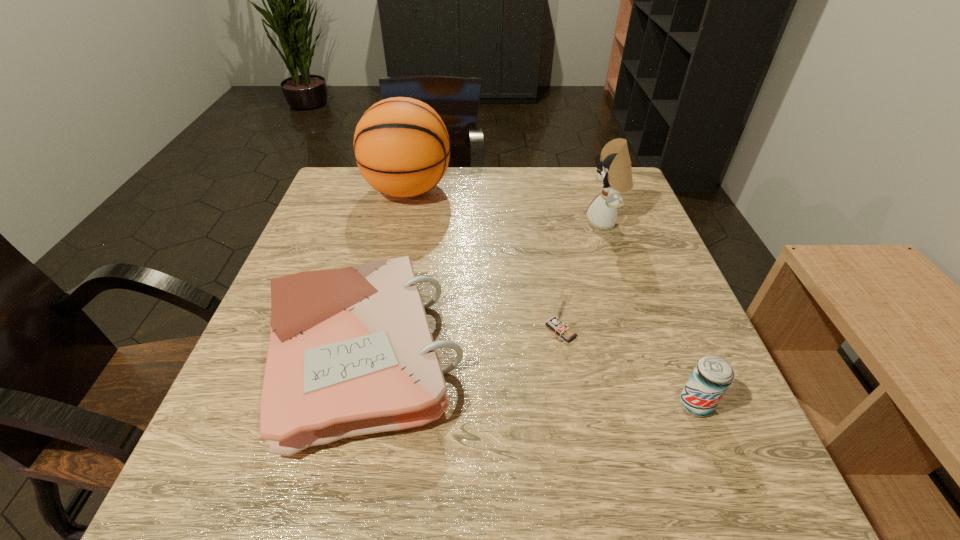
At what (x,y) coordinates should I click in order to perform the action: click on vacant space situated on the back of the beer can. Please return your answer as a coordinate pair (x, y). The image size is (960, 540). Looking at the image, I should click on (658, 309).

Find the location of a particular element. Image resolution: width=960 pixels, height=540 pixels. free space located on the right of the shortest object is located at coordinates (566, 355).

This screenshot has height=540, width=960. Identify the location of basketball that is at the far edge. (401, 145).

Where is `doll that is at the far edge`? This screenshot has height=540, width=960. doll that is at the far edge is located at coordinates (614, 169).

What are the coordinates of `object that is at the near edge` in the screenshot? It's located at (351, 352).

This screenshot has width=960, height=540. What are the coordinates of `basketball that is at the left edge` in the screenshot? It's located at (401, 145).

Identify the location of phonebook that is at the left edge. (351, 352).

Where is `doll situated at the right edge`? Image resolution: width=960 pixels, height=540 pixels. doll situated at the right edge is located at coordinates (614, 169).

Where is `beer can present at the right edge`? Image resolution: width=960 pixels, height=540 pixels. beer can present at the right edge is located at coordinates (712, 376).

Locate an element on the screen. The image size is (960, 540). object present at the far left corner is located at coordinates (401, 145).